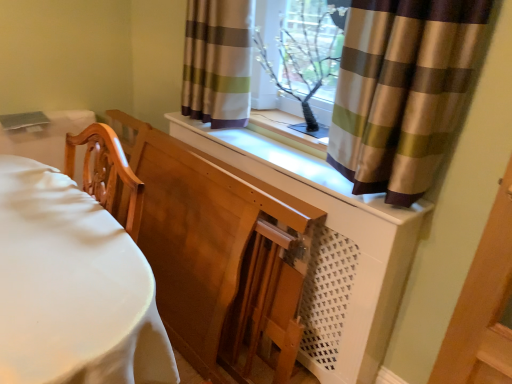
Question: Which direction should I rotate to look at striped fabric curtain at upper center, which is counted as the 2th curtain, starting from the right, — up or down?

Choices:
 (A) down
 (B) up

Answer: (B)

Question: Is the position of white matte dresser at center less distant than that of clear glass window frame at upper center?

Choices:
 (A) yes
 (B) no

Answer: (A)

Question: Would you say white matte dresser at center is outside clear glass window frame at upper center?

Choices:
 (A) yes
 (B) no

Answer: (A)

Question: Is white matte dresser at center wider than clear glass window frame at upper center?

Choices:
 (A) yes
 (B) no

Answer: (A)

Question: Is white matte dresser at center smaller than clear glass window frame at upper center?

Choices:
 (A) yes
 (B) no

Answer: (B)

Question: Considering the relative sizes of white matte dresser at center and clear glass window frame at upper center in the image provided, is white matte dresser at center taller than clear glass window frame at upper center?

Choices:
 (A) yes
 (B) no

Answer: (A)

Question: Could you tell me if white matte dresser at center is facing clear glass window frame at upper center?

Choices:
 (A) yes
 (B) no

Answer: (B)

Question: Is wooden chair at left outside brown striped curtain at upper center, which ranks as the second curtain in left-to-right order?

Choices:
 (A) yes
 (B) no

Answer: (A)

Question: Is wooden chair at left not close to brown striped curtain at upper center, which is the 1th curtain from right to left?

Choices:
 (A) yes
 (B) no

Answer: (B)

Question: Is wooden chair at left aimed at brown striped curtain at upper center, the second curtain viewed from the back?

Choices:
 (A) no
 (B) yes

Answer: (A)

Question: Is brown striped curtain at upper center, the second curtain viewed from the back, located within wooden chair at left?

Choices:
 (A) no
 (B) yes

Answer: (A)

Question: Is wooden chair at left looking in the opposite direction of brown striped curtain at upper center, the first curtain positioned from the front?

Choices:
 (A) yes
 (B) no

Answer: (A)

Question: Is wooden chair at left positioned before brown striped curtain at upper center, which is the 1th curtain from right to left?

Choices:
 (A) no
 (B) yes

Answer: (B)

Question: Can you confirm if clear glass window frame at upper center is taller than brown striped curtain at upper center, which ranks as the second curtain in left-to-right order?

Choices:
 (A) no
 (B) yes

Answer: (A)